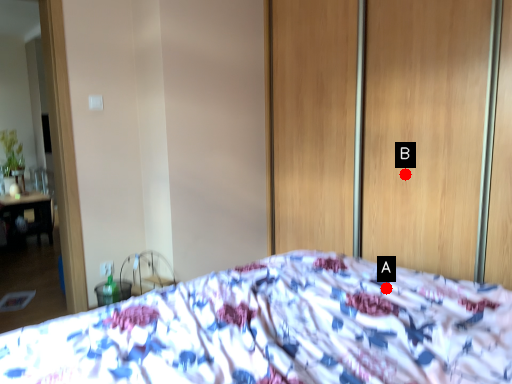
Question: Two points are circled on the image, labeled by A and B beside each circle. Which point is further to the camera?

Choices:
 (A) A is further
 (B) B is further

Answer: (B)